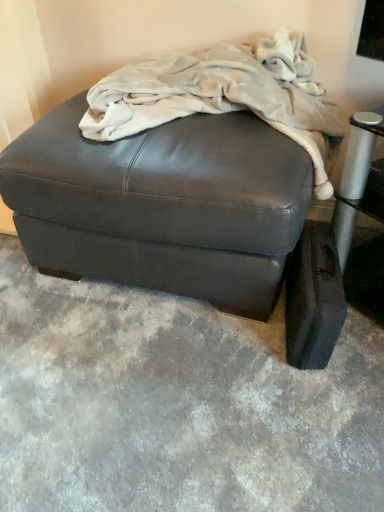
Question: From a real-world perspective, is matte black ottoman at center below leather ottoman at lower right?

Choices:
 (A) yes
 (B) no

Answer: (B)

Question: Does matte black ottoman at center come in front of leather ottoman at lower right?

Choices:
 (A) yes
 (B) no

Answer: (A)

Question: Is matte black ottoman at center not close to leather ottoman at lower right?

Choices:
 (A) no
 (B) yes

Answer: (A)

Question: Does matte black ottoman at center have a greater width compared to leather ottoman at lower right?

Choices:
 (A) yes
 (B) no

Answer: (A)

Question: Is matte black ottoman at center shorter than leather ottoman at lower right?

Choices:
 (A) no
 (B) yes

Answer: (A)

Question: Considering the positions of matte black ottoman at center and fuzzy white blanket at upper center in the image, is matte black ottoman at center bigger or smaller than fuzzy white blanket at upper center?

Choices:
 (A) small
 (B) big

Answer: (B)

Question: Is matte black ottoman at center wider or thinner than fuzzy white blanket at upper center?

Choices:
 (A) wide
 (B) thin

Answer: (A)

Question: Visually, is matte black ottoman at center positioned to the left or to the right of fuzzy white blanket at upper center?

Choices:
 (A) right
 (B) left

Answer: (B)

Question: Is matte black ottoman at center inside the boundaries of fuzzy white blanket at upper center, or outside?

Choices:
 (A) outside
 (B) inside

Answer: (A)

Question: In the image, is fuzzy white blanket at upper center on the left side or the right side of matte black ottoman at center?

Choices:
 (A) right
 (B) left

Answer: (A)

Question: Is fuzzy white blanket at upper center inside or outside of matte black ottoman at center?

Choices:
 (A) outside
 (B) inside

Answer: (B)

Question: From the image's perspective, is fuzzy white blanket at upper center above or below matte black ottoman at center?

Choices:
 (A) below
 (B) above

Answer: (B)

Question: Is fuzzy white blanket at upper center taller or shorter than matte black ottoman at center?

Choices:
 (A) short
 (B) tall

Answer: (A)

Question: From a real-world perspective, is matte black ottoman at center above or below leather ottoman at lower right?

Choices:
 (A) below
 (B) above

Answer: (B)

Question: In terms of width, does matte black ottoman at center look wider or thinner when compared to leather ottoman at lower right?

Choices:
 (A) thin
 (B) wide

Answer: (B)